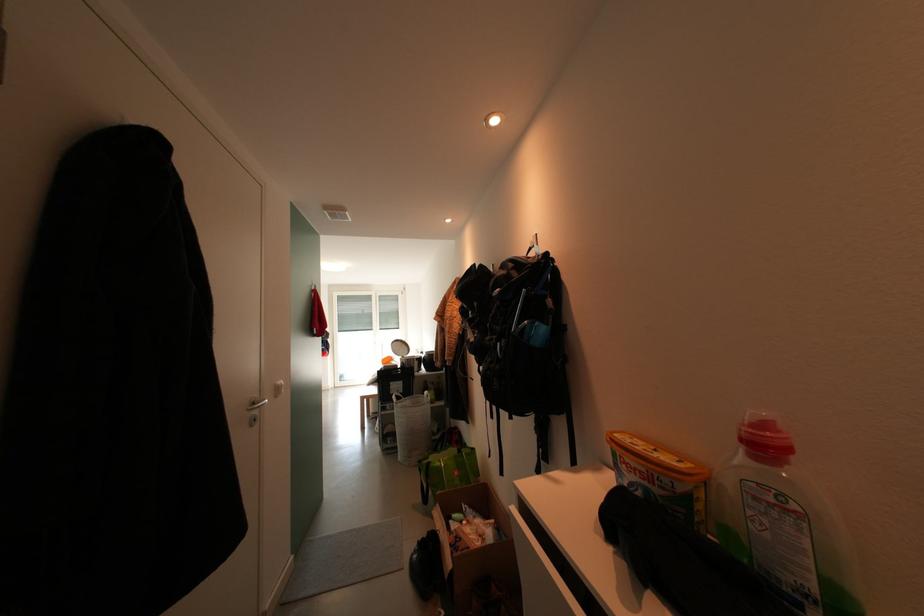
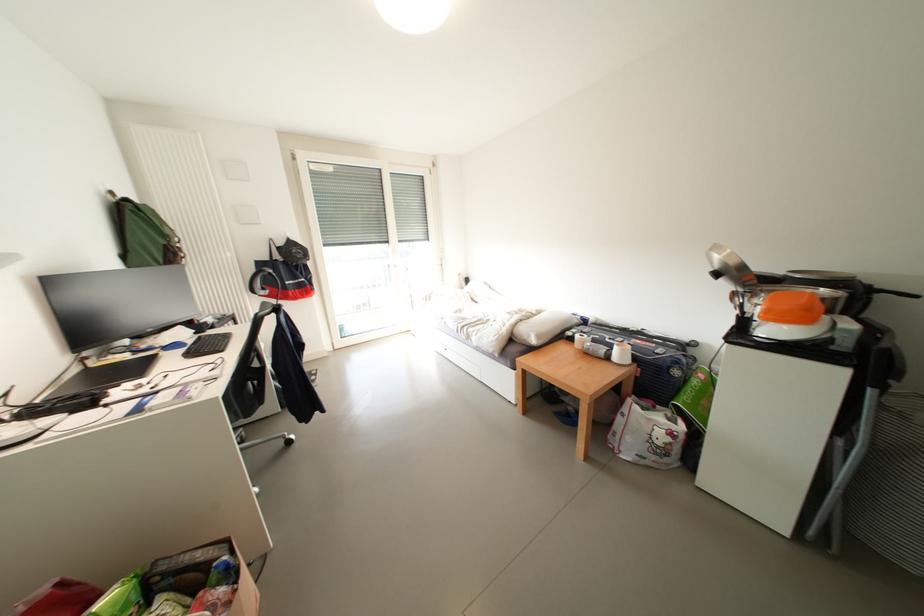
Which direction would the cameraman need to move to produce the second image?

The cameraman walked toward left, forward.